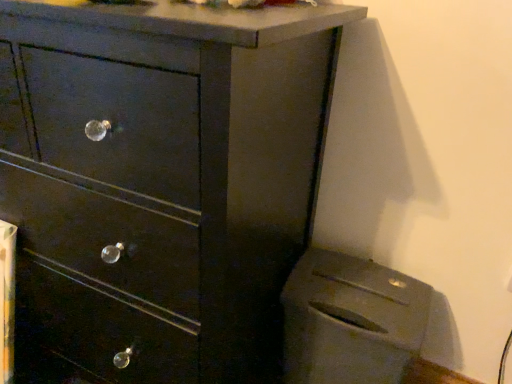
Locate an element on the screen. matte black dresser at center is located at coordinates pyautogui.click(x=159, y=183).

This screenshot has width=512, height=384. What do you see at coordinates (159, 183) in the screenshot? I see `matte black dresser at center` at bounding box center [159, 183].

Measure the distance between matte black dresser at center and camera.

matte black dresser at center is 48.53 centimeters away from camera.

This screenshot has height=384, width=512. Identify the location of matte gray trash can at lower right. (350, 320).

Measure the distance between point (341, 380) and camera.

They are 38.74 inches apart.

Describe the element at coordinates (350, 320) in the screenshot. I see `matte gray trash can at lower right` at that location.

Image resolution: width=512 pixels, height=384 pixels. What are the coordinates of `matte black dresser at center` in the screenshot? It's located at (159, 183).

Is matte black dresser at center at the left side of matte gray trash can at lower right?

Yes.

In the image, is matte black dresser at center positioned in front of or behind matte gray trash can at lower right?

matte black dresser at center is in front of matte gray trash can at lower right.

Considering the positions of points (148, 286) and (330, 319), is point (148, 286) closer to camera compared to point (330, 319)?

That is True.

In the scene shown: From the image's perspective, which one is positioned higher, matte black dresser at center or matte gray trash can at lower right?

matte black dresser at center.

From a real-world perspective, is matte black dresser at center on matte gray trash can at lower right?

Correct, in the physical world, matte black dresser at center is higher than matte gray trash can at lower right.

Considering the sizes of objects matte black dresser at center and matte gray trash can at lower right in the image provided, who is wider, matte black dresser at center or matte gray trash can at lower right?

Wider between the two is matte black dresser at center.

Can you confirm if matte black dresser at center is shorter than matte gray trash can at lower right?

Incorrect, the height of matte black dresser at center does not fall short of that of matte gray trash can at lower right.

In the scene shown: Does matte black dresser at center have a smaller size compared to matte gray trash can at lower right?

Actually, matte black dresser at center might be larger than matte gray trash can at lower right.

Is matte black dresser at center completely or partially outside of matte gray trash can at lower right?

matte black dresser at center lies outside matte gray trash can at lower right's area.

Would you say matte black dresser at center is a long distance from matte gray trash can at lower right?

No, matte black dresser at center is in close proximity to matte gray trash can at lower right.

Is matte black dresser at center positioned with its back to matte gray trash can at lower right?

matte black dresser at center does not have its back to matte gray trash can at lower right.

Identify the location of appliance behind the matte black dresser at center. The width and height of the screenshot is (512, 384). (350, 320).

From the picture: Which is more to the left, matte gray trash can at lower right or matte black dresser at center?

Positioned to the left is matte black dresser at center.

Considering the positions of objects matte gray trash can at lower right and matte black dresser at center in the image provided, who is behind, matte gray trash can at lower right or matte black dresser at center?

matte gray trash can at lower right is further away from the camera.

Considering the positions of points (362, 381) and (79, 38), is point (362, 381) farther from camera compared to point (79, 38)?

That is True.

From the image's perspective, is matte gray trash can at lower right under matte black dresser at center?

Yes, from the image's perspective, matte gray trash can at lower right is below matte black dresser at center.

From a real-world perspective, who is located higher, matte gray trash can at lower right or matte black dresser at center?

matte black dresser at center.

Looking at their sizes, would you say matte gray trash can at lower right is wider or thinner than matte black dresser at center?

Considering their sizes, matte gray trash can at lower right looks slimmer than matte black dresser at center.

Between matte gray trash can at lower right and matte black dresser at center, which one has less height?

With less height is matte gray trash can at lower right.

Consider the image. Does matte gray trash can at lower right have a smaller size compared to matte black dresser at center?

Yes.

Would you say matte gray trash can at lower right is outside matte black dresser at center?

Yes, matte gray trash can at lower right is located beyond the bounds of matte black dresser at center.

Would you consider matte gray trash can at lower right to be distant from matte black dresser at center?

No, there isn't a large distance between matte gray trash can at lower right and matte black dresser at center.

Could you tell me if matte gray trash can at lower right is facing matte black dresser at center?

No, matte gray trash can at lower right is not oriented towards matte black dresser at center.

Based on the photo, how different are the orientations of matte gray trash can at lower right and matte black dresser at center in degrees?

The facing directions of matte gray trash can at lower right and matte black dresser at center are 0.929 degrees apart.

Measure the distance from matte gray trash can at lower right to matte black dresser at center.

matte gray trash can at lower right and matte black dresser at center are 12.67 inches apart.

I want to click on appliance below the matte black dresser at center (from a real-world perspective), so click(350, 320).

This screenshot has width=512, height=384. I want to click on chest of drawers in front of the matte gray trash can at lower right, so click(x=159, y=183).

This screenshot has height=384, width=512. I want to click on appliance that appears behind the matte black dresser at center, so click(350, 320).